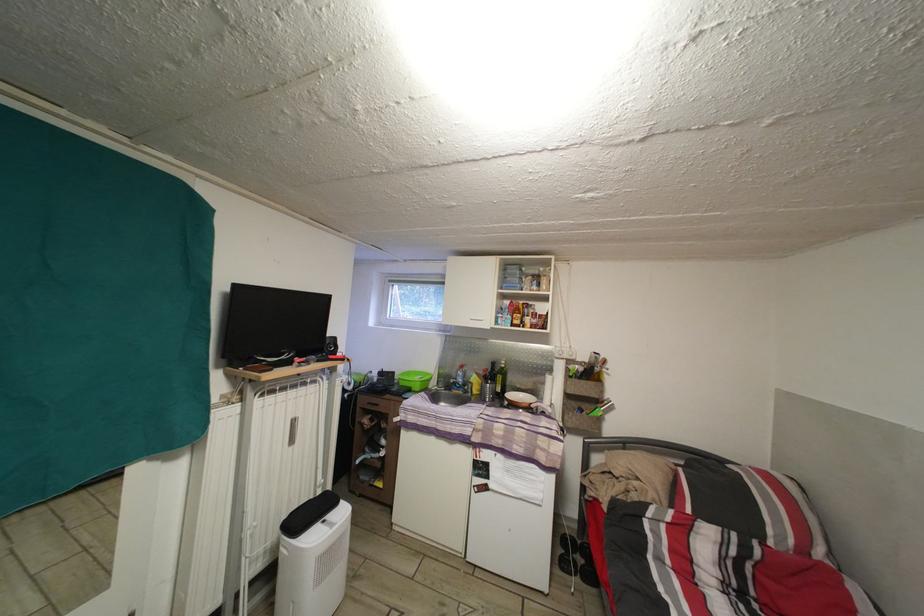
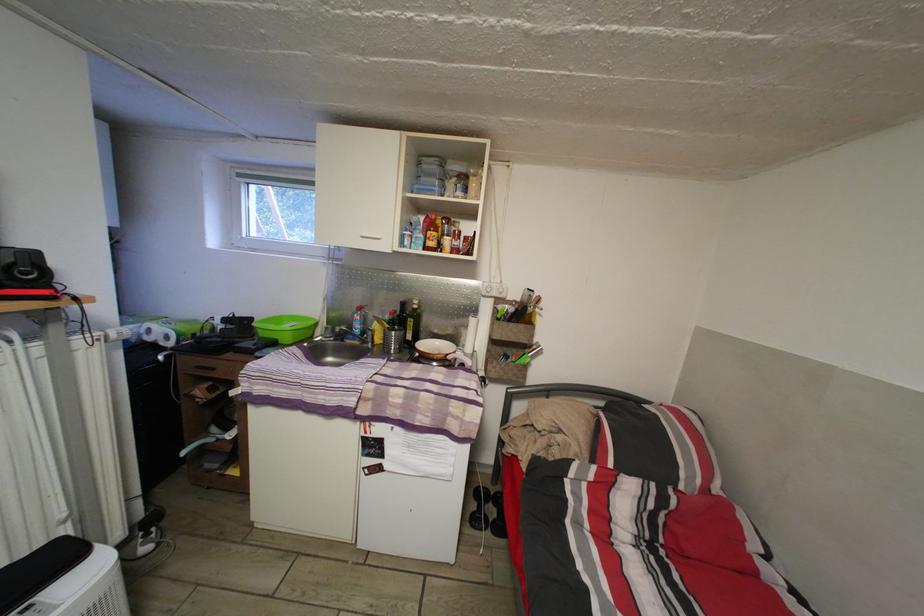
Where in the second image is the point corresponding to (x=579, y=546) from the first image?

(493, 498)